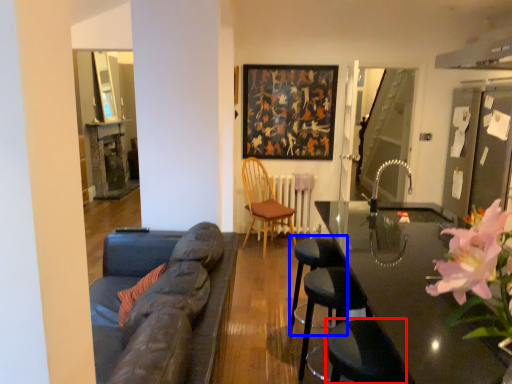
Question: Which object is closer to the camera taking this photo, swivel chair (highlighted by a red box) or bar stool (highlighted by a blue box)?

Choices:
 (A) swivel chair
 (B) bar stool

Answer: (A)